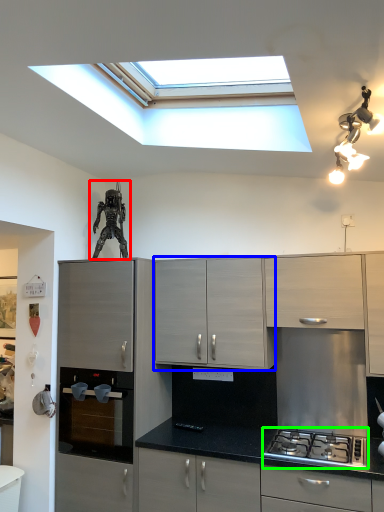
Question: Which is farther away from sculpture (highlighted by a red box)? cabinetry (highlighted by a blue box) or gas stove (highlighted by a green box)?

Choices:
 (A) cabinetry
 (B) gas stove

Answer: (B)